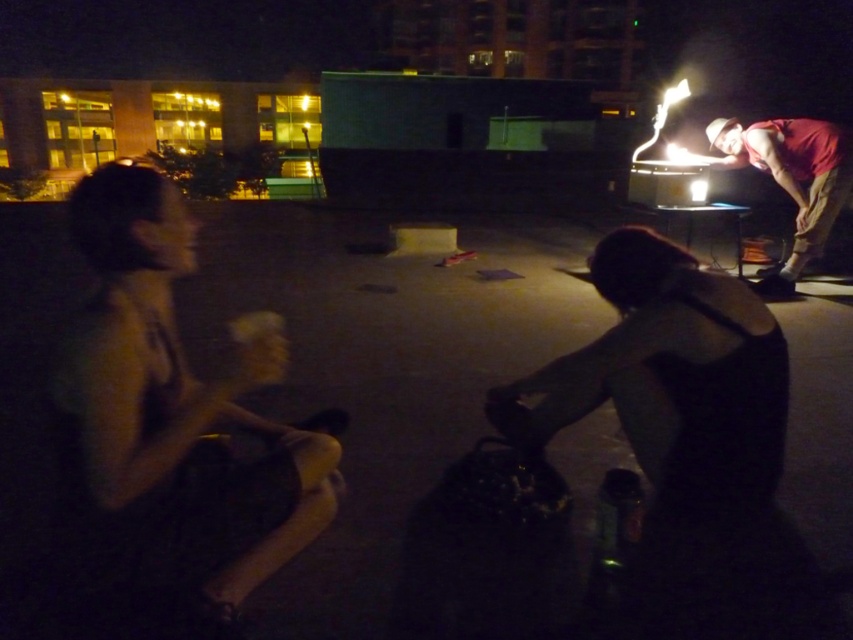
Question: Can you confirm if dark skin tone shirt at left is wider than black matte tank top at lower right?

Choices:
 (A) no
 (B) yes

Answer: (A)

Question: Does black matte tank top at lower right have a smaller size compared to red fabric shirt at right?

Choices:
 (A) yes
 (B) no

Answer: (A)

Question: Can you confirm if dark skin tone shirt at left is positioned above black matte tank top at lower right?

Choices:
 (A) yes
 (B) no

Answer: (B)

Question: Estimate the real-world distances between objects in this image. Which object is farther from the red fabric shirt at right?

Choices:
 (A) black matte tank top at lower right
 (B) dark skin tone shirt at left

Answer: (B)

Question: Which object appears farthest from the camera in this image?

Choices:
 (A) black matte tank top at lower right
 (B) red fabric shirt at right
 (C) dark skin tone shirt at left

Answer: (B)

Question: Which of the following is the closest to the observer?

Choices:
 (A) dark skin tone shirt at left
 (B) black matte tank top at lower right
 (C) red fabric shirt at right

Answer: (A)